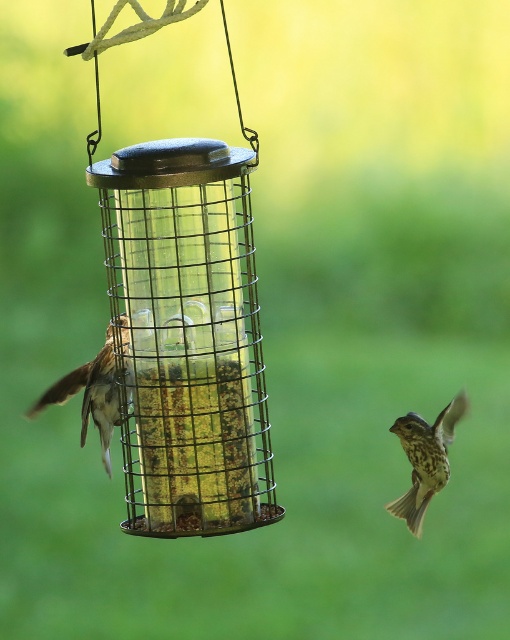
Can you confirm if metallic wire mesh bird feeder at left is taller than brown speckled sparrow at lower right?

Yes.

Measure the distance between metallic wire mesh bird feeder at left and camera.

metallic wire mesh bird feeder at left and camera are 5.25 feet apart.

Is point (178, 10) positioned behind point (466, 404)?

No, it is in front of (466, 404).

This screenshot has height=640, width=510. Identify the location of metallic wire mesh bird feeder at left. (186, 321).

Measure the distance between metallic wire mesh bird feeder at left and brown speckled feathers at left.

metallic wire mesh bird feeder at left is 6.20 inches from brown speckled feathers at left.

Does metallic wire mesh bird feeder at left have a greater height compared to brown speckled feathers at left?

Yes, metallic wire mesh bird feeder at left is taller than brown speckled feathers at left.

The height and width of the screenshot is (640, 510). Identify the location of metallic wire mesh bird feeder at left. pyautogui.click(x=186, y=321).

The image size is (510, 640). Find the location of `metallic wire mesh bird feeder at left`. metallic wire mesh bird feeder at left is located at coordinates (186, 321).

Looking at this image, which is above, brown speckled feathers at left or brown speckled sparrow at lower right?

brown speckled feathers at left is above.

Which is in front, point (112, 346) or point (413, 422)?

Point (112, 346) is more forward.

Measure the distance between point [109,378] and camera.

They are 6.19 feet apart.

Find the location of `brown speckled feathers at left`. brown speckled feathers at left is located at coordinates (96, 388).